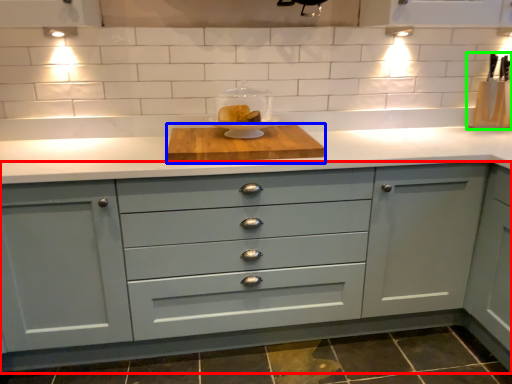
Question: Which is farther away from cabinetry (highlighted by a red box)? cutting board (highlighted by a blue box) or appliance (highlighted by a green box)?

Choices:
 (A) cutting board
 (B) appliance

Answer: (B)